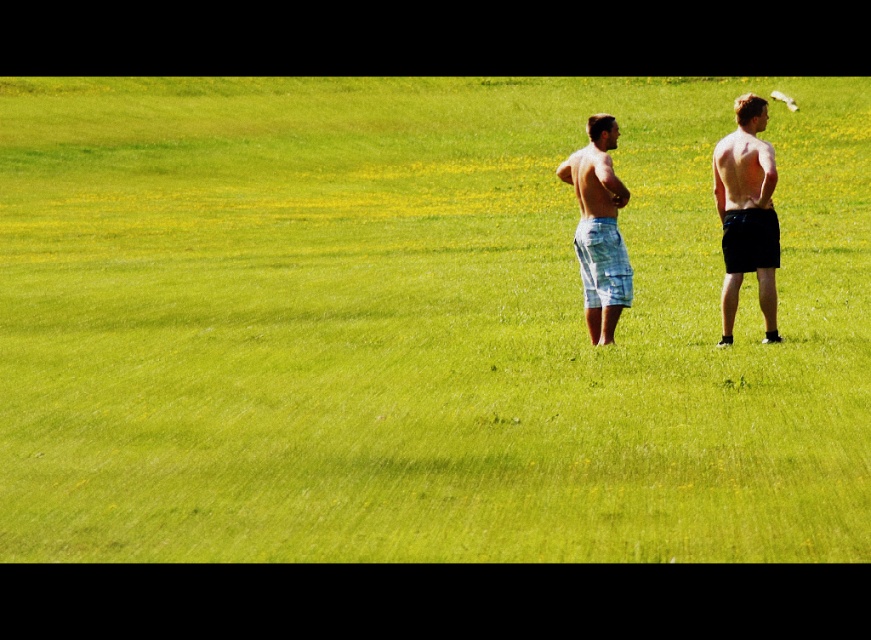
Who is taller, black matte shorts at right or light blue plaid shorts at center?

With more height is black matte shorts at right.

Can you confirm if black matte shorts at right is positioned to the right of light blue plaid shorts at center?

Indeed, black matte shorts at right is positioned on the right side of light blue plaid shorts at center.

Is point (731, 163) closer to camera compared to point (611, 280)?

Yes, it is in front of point (611, 280).

Locate an element on the screen. The width and height of the screenshot is (871, 640). black matte shorts at right is located at coordinates (747, 212).